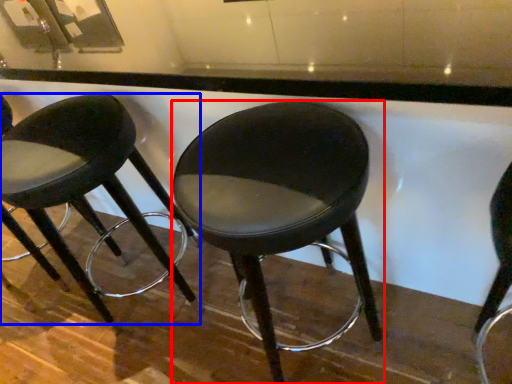
Question: Which point is closer to the camera, stool (highlighted by a red box) or stool (highlighted by a blue box)?

Choices:
 (A) stool
 (B) stool

Answer: (A)